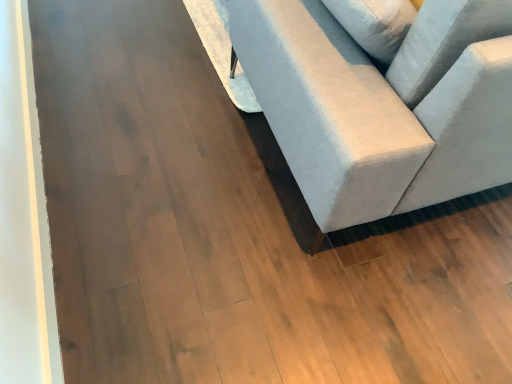
At what (x,y) coordinates should I click in order to perform the action: click on vacant space that is to the left of light gray fabric couch at center. Please return your answer as a coordinate pair (x, y). The image size is (512, 384). Looking at the image, I should click on (141, 94).